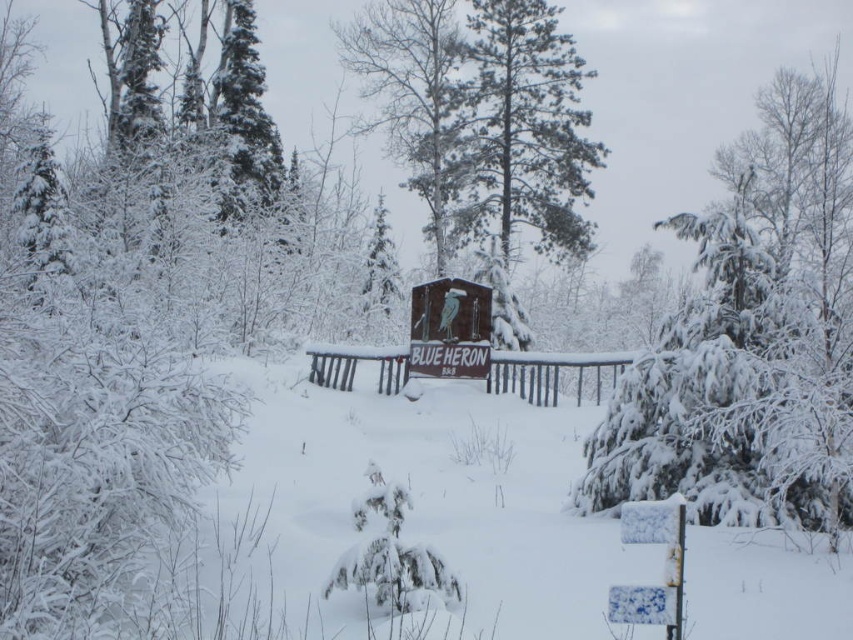
Question: Which point appears farthest from the camera in this image?

Choices:
 (A) (260, 435)
 (B) (781, 284)
 (C) (445, 218)

Answer: (C)

Question: Is snow-covered evergreen at center below snow-covered pine tree at center?

Choices:
 (A) yes
 (B) no

Answer: (A)

Question: Can you confirm if white fluffy snow at center is positioned to the right of snow-covered evergreen at center?

Choices:
 (A) no
 (B) yes

Answer: (A)

Question: Is snow-covered evergreen at center smaller than snow-covered pine tree at center?

Choices:
 (A) yes
 (B) no

Answer: (B)

Question: Which point appears farthest from the camera in this image?

Choices:
 (A) (778, 561)
 (B) (651, 365)
 (C) (434, 161)

Answer: (C)

Question: Which point is closer to the camera taking this photo?

Choices:
 (A) (770, 216)
 (B) (445, 262)

Answer: (B)